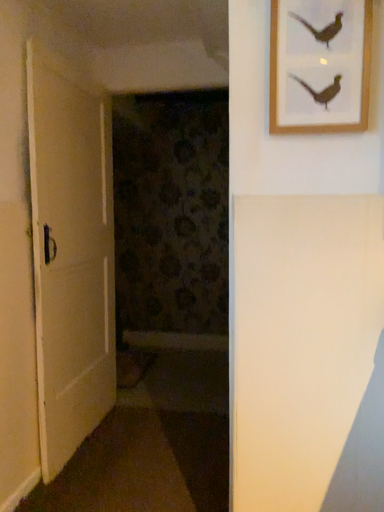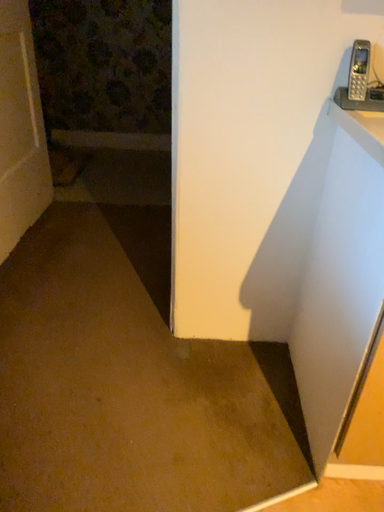
Question: Which way did the camera rotate in the video?

Choices:
 (A) rotated downward
 (B) rotated upward

Answer: (A)